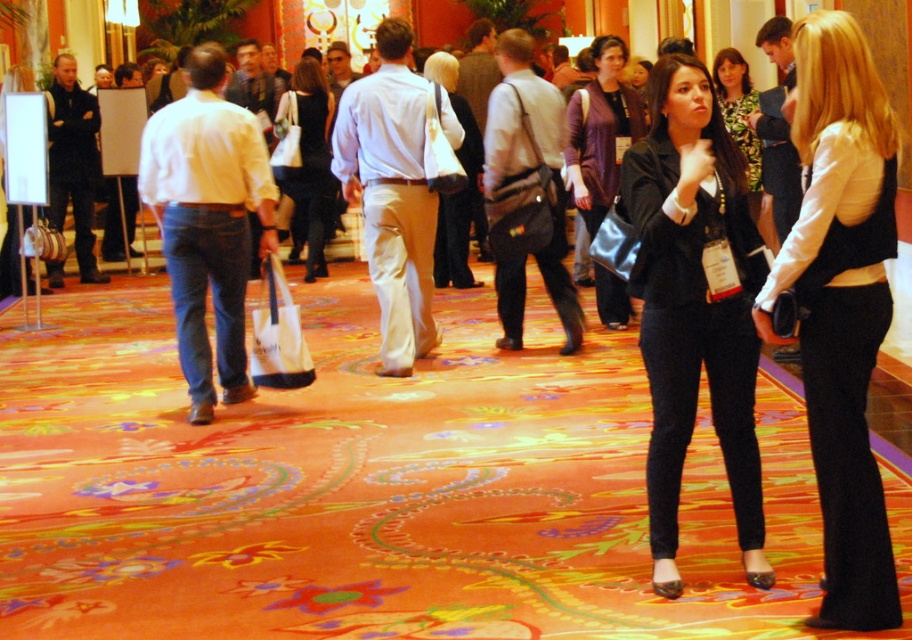
You are standing in the conference hall and want to find the black satin vest at center. According to the coordinates given, where should you look? Please answer with the coordinates provided in the description.

The black satin vest at center is located at coordinates point (841,305).